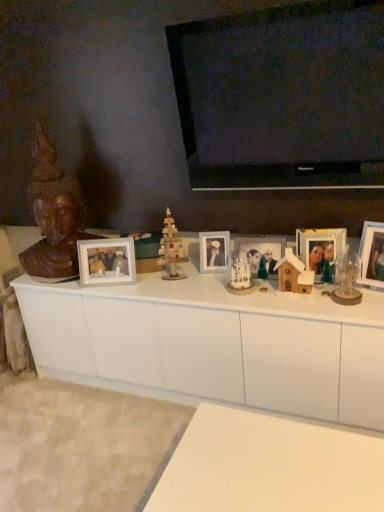
The image size is (384, 512). In order to click on free spot in front of wooden christmas tree at center, which is counted as the third toy, starting from the right in this screenshot , I will do `click(177, 290)`.